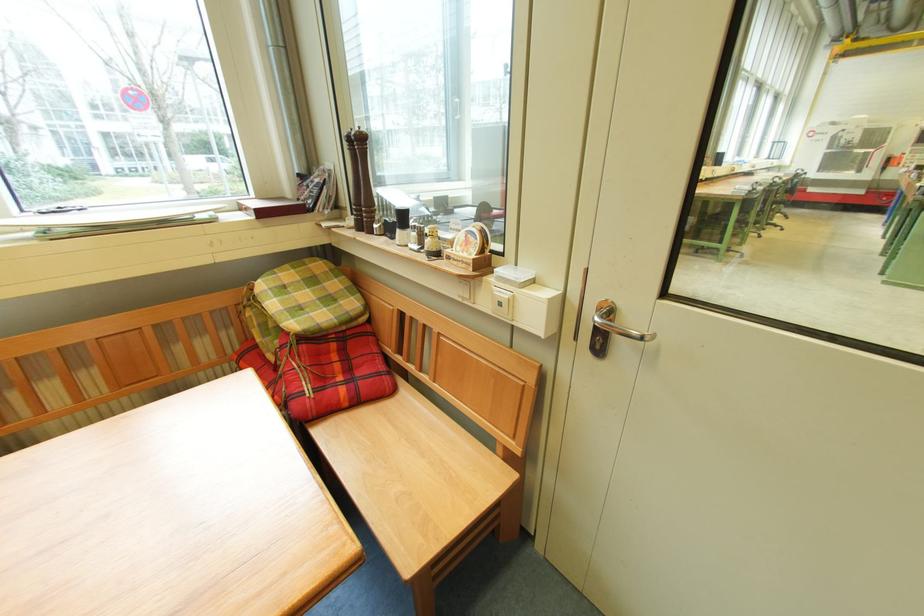
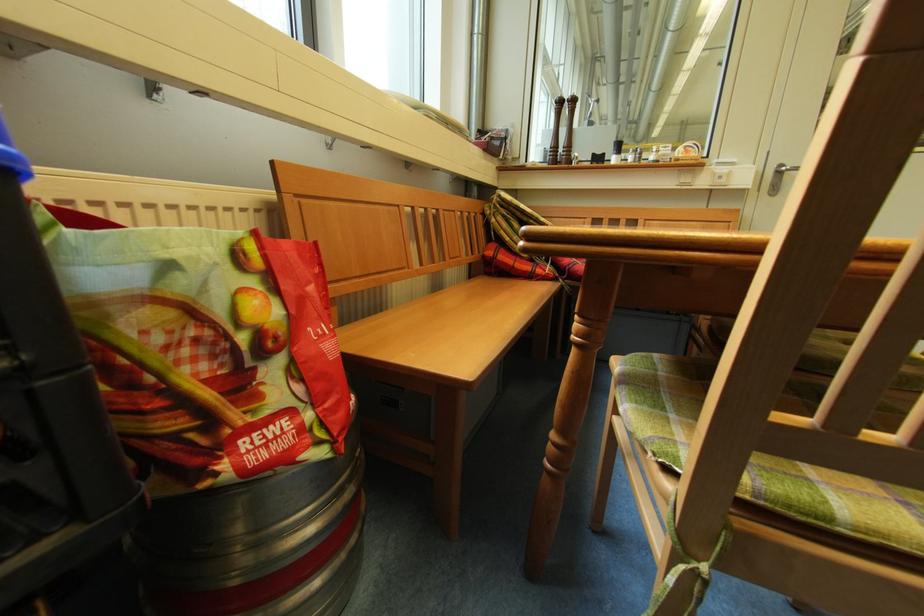
Question: In a continuous first-person perspective shot, in which direction is the camera moving?

Choices:
 (A) Left
 (B) Right
 (C) Forward
 (D) Backward

Answer: (A)